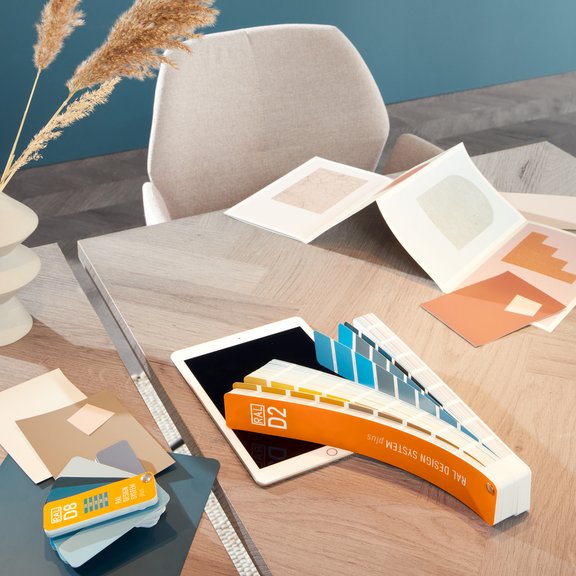
I want to click on book of paint swatches, so click(335, 435).